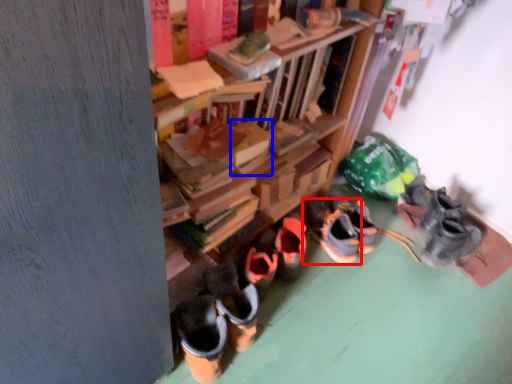
Question: Which point is closer to the camera, footwear (highlighted by a red box) or book (highlighted by a blue box)?

Choices:
 (A) footwear
 (B) book

Answer: (B)